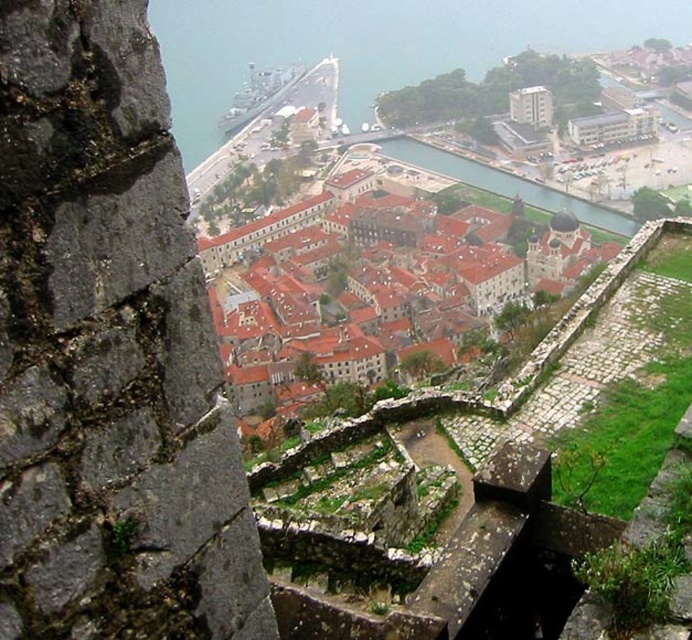
Question: Is brown tiled roofs at center thinner than clear water at center?

Choices:
 (A) no
 (B) yes

Answer: (A)

Question: Is brown tiled roofs at center thinner than clear water at center?

Choices:
 (A) yes
 (B) no

Answer: (B)

Question: Does brown tiled roofs at center appear over clear water at center?

Choices:
 (A) no
 (B) yes

Answer: (A)

Question: Among these objects, which one is farthest from the camera?

Choices:
 (A) brown tiled roofs at center
 (B) clear water at center

Answer: (B)